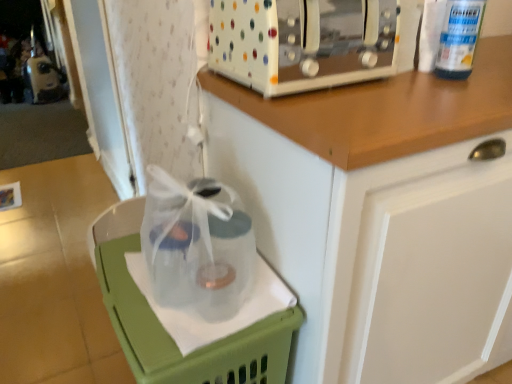
Question: From the image's perspective, is white glossy cabinet at upper center positioned above or below green plastic basket at lower left?

Choices:
 (A) above
 (B) below

Answer: (A)

Question: Would you say white glossy cabinet at upper center is to the left or to the right of green plastic basket at lower left in the picture?

Choices:
 (A) left
 (B) right

Answer: (B)

Question: Estimate the real-world distances between objects in this image. Which object is farther from the white plastic bottle at upper right?

Choices:
 (A) white glossy cabinet at upper center
 (B) green plastic basket at lower left
 (C) white polka dot toaster at upper center

Answer: (B)

Question: Which of these objects is positioned closest to the white plastic bottle at upper right?

Choices:
 (A) white polka dot toaster at upper center
 (B) white glossy cabinet at upper center
 (C) green plastic basket at lower left

Answer: (A)